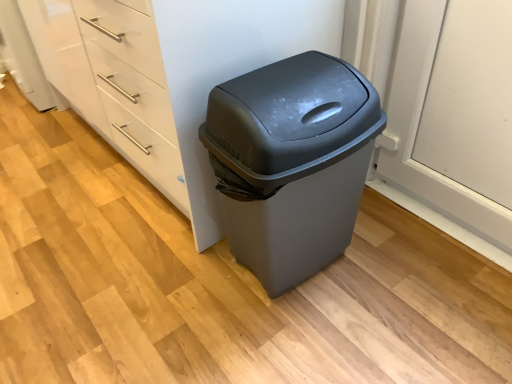
Question: Should I look upward or downward to see white glossy dresser at center?

Choices:
 (A) up
 (B) down

Answer: (A)

Question: Does white glossy dresser at center have a smaller size compared to matte gray plastic trash can at center?

Choices:
 (A) no
 (B) yes

Answer: (A)

Question: From a real-world perspective, is white glossy dresser at center located higher than matte gray plastic trash can at center?

Choices:
 (A) no
 (B) yes

Answer: (B)

Question: Does white glossy dresser at center have a greater height compared to matte gray plastic trash can at center?

Choices:
 (A) no
 (B) yes

Answer: (B)

Question: Are white glossy dresser at center and matte gray plastic trash can at center making contact?

Choices:
 (A) no
 (B) yes

Answer: (A)

Question: Is white glossy dresser at center positioned with its back to matte gray plastic trash can at center?

Choices:
 (A) yes
 (B) no

Answer: (B)

Question: Considering the relative sizes of white glossy dresser at center and matte gray plastic trash can at center in the image provided, is white glossy dresser at center thinner than matte gray plastic trash can at center?

Choices:
 (A) no
 (B) yes

Answer: (A)

Question: Is matte gray plastic trash can at center next to white glossy dresser at center and touching it?

Choices:
 (A) no
 (B) yes

Answer: (A)

Question: Is matte gray plastic trash can at center facing towards white glossy dresser at center?

Choices:
 (A) yes
 (B) no

Answer: (B)

Question: Is matte gray plastic trash can at center facing away from white glossy dresser at center?

Choices:
 (A) yes
 (B) no

Answer: (A)

Question: Does matte gray plastic trash can at center contain white glossy dresser at center?

Choices:
 (A) no
 (B) yes

Answer: (A)

Question: Is matte gray plastic trash can at center outside white glossy dresser at center?

Choices:
 (A) yes
 (B) no

Answer: (A)

Question: Does matte gray plastic trash can at center have a lesser height compared to white glossy dresser at center?

Choices:
 (A) yes
 (B) no

Answer: (A)

Question: Is matte gray plastic trash can at center to the left or to the right of white glossy dresser at center in the image?

Choices:
 (A) left
 (B) right

Answer: (B)